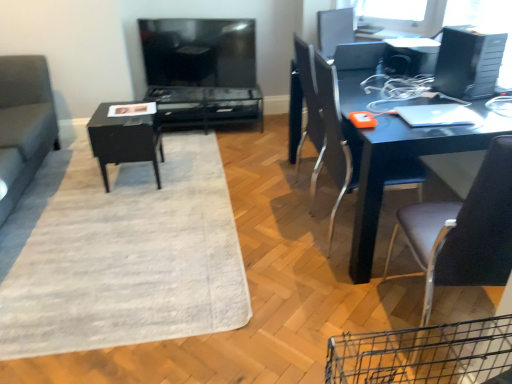
Question: From a real-world perspective, is matte black tv at upper center beneath black glossy table at center, which appears as the 2th table when viewed from the back?

Choices:
 (A) yes
 (B) no

Answer: (B)

Question: From the image's perspective, does matte black tv at upper center appear higher than black glossy table at center, which is the first table in front-to-back order?

Choices:
 (A) yes
 (B) no

Answer: (A)

Question: Is black glossy table at center, which appears as the 2th table when viewed from the back, inside matte black tv at upper center?

Choices:
 (A) no
 (B) yes

Answer: (A)

Question: Is matte black tv at upper center thinner than black glossy table at center, which appears as the 2th table when viewed from the back?

Choices:
 (A) no
 (B) yes

Answer: (B)

Question: Can you confirm if matte black tv at upper center is smaller than black glossy table at center, which is the first table in front-to-back order?

Choices:
 (A) no
 (B) yes

Answer: (B)

Question: From a real-world perspective, is black plastic desktop computer at upper right physically located above or below leather-like brown chair at right, which is counted as the 2th chair, starting from the back?

Choices:
 (A) below
 (B) above

Answer: (B)

Question: Considering their positions, is black plastic desktop computer at upper right located in front of or behind leather-like brown chair at right, which is counted as the 2th chair, starting from the back?

Choices:
 (A) behind
 (B) front

Answer: (A)

Question: Is point (443, 54) closer or farther from the camera than point (461, 223)?

Choices:
 (A) closer
 (B) farther

Answer: (B)

Question: From the image's perspective, is black plastic desktop computer at upper right positioned above or below leather-like brown chair at right, which is counted as the 2th chair, starting from the back?

Choices:
 (A) above
 (B) below

Answer: (A)

Question: Would you say matte black chair at right, which is counted as the 2th chair, starting from the front, is to the left or to the right of silver metallic laptop at upper right in the picture?

Choices:
 (A) right
 (B) left

Answer: (B)

Question: In terms of width, does matte black chair at right, the 1th chair when ordered from back to front, look wider or thinner when compared to silver metallic laptop at upper right?

Choices:
 (A) thin
 (B) wide

Answer: (B)

Question: Is matte black chair at right, which is counted as the 2th chair, starting from the front, bigger or smaller than silver metallic laptop at upper right?

Choices:
 (A) small
 (B) big

Answer: (B)

Question: Is matte black chair at right, the 1th chair when ordered from back to front, in front of or behind silver metallic laptop at upper right in the image?

Choices:
 (A) behind
 (B) front

Answer: (B)

Question: From a real-world perspective, is black glossy table at center, which is the first table in front-to-back order, positioned above or below metallic blue desk at right?

Choices:
 (A) above
 (B) below

Answer: (B)

Question: Visually, is black glossy table at center, which is the first table in front-to-back order, positioned to the left or to the right of metallic blue desk at right?

Choices:
 (A) right
 (B) left

Answer: (B)